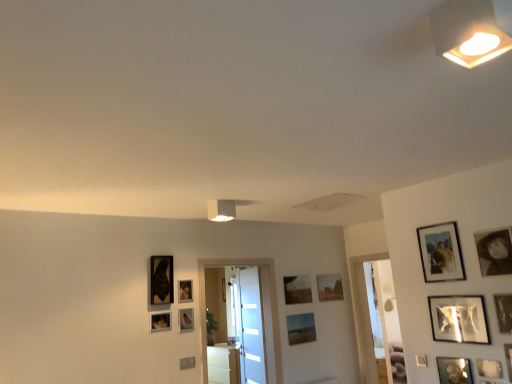
Question: From the image's perspective, does matte wooden picture frame at center, marked as the 10th picture frame in a right-to-left arrangement, appear higher than matte black picture frame at lower left, positioned as the 2th picture frame in left-to-right order?

Choices:
 (A) yes
 (B) no

Answer: (A)

Question: From the image's perspective, is matte wooden picture frame at center, marked as the fifth picture frame in a left-to-right arrangement, beneath matte black picture frame at lower left, marked as the 8th picture frame in a front-to-back arrangement?

Choices:
 (A) no
 (B) yes

Answer: (A)

Question: From a real-world perspective, is matte wooden picture frame at center, which is the 2th picture frame in back-to-front order, under matte black picture frame at lower left, positioned as the thirteenth picture frame in right-to-left order?

Choices:
 (A) yes
 (B) no

Answer: (B)

Question: Does matte wooden picture frame at center, which is the 2th picture frame in back-to-front order, have a lesser height compared to matte black picture frame at lower left, marked as the 8th picture frame in a front-to-back arrangement?

Choices:
 (A) yes
 (B) no

Answer: (B)

Question: Does matte wooden picture frame at center, which is the 2th picture frame in back-to-front order, have a lesser width compared to matte black picture frame at lower left, marked as the 8th picture frame in a front-to-back arrangement?

Choices:
 (A) yes
 (B) no

Answer: (B)

Question: Is matte wooden picture frame at center, marked as the fifth picture frame in a left-to-right arrangement, outside of matte black picture frame at lower left, positioned as the 2th picture frame in left-to-right order?

Choices:
 (A) yes
 (B) no

Answer: (A)

Question: Is matte black picture frame at center, the 4th picture frame when ordered from left to right, far away from matte black picture frame at upper right, which is the eleventh picture frame from left to right?

Choices:
 (A) no
 (B) yes

Answer: (B)

Question: Is matte black picture frame at center, the 11th picture frame when ordered from right to left, to the left of matte black picture frame at upper right, the fourth picture frame viewed from the front, from the viewer's perspective?

Choices:
 (A) yes
 (B) no

Answer: (A)

Question: Is matte black picture frame at center, the 4th picture frame when ordered from left to right, bigger than matte black picture frame at upper right, which is the eleventh picture frame from left to right?

Choices:
 (A) yes
 (B) no

Answer: (A)

Question: From the image's perspective, is matte black picture frame at center, which is the fifth picture frame in back-to-front order, located beneath matte black picture frame at upper right, the fourth picture frame viewed from the front?

Choices:
 (A) no
 (B) yes

Answer: (B)

Question: Can you confirm if matte black picture frame at center, which is the fifth picture frame in back-to-front order, is thinner than matte black picture frame at upper right, which is the eleventh picture frame from left to right?

Choices:
 (A) no
 (B) yes

Answer: (A)

Question: Is matte black picture frame at center, the 4th picture frame when ordered from left to right, at the right side of matte black picture frame at upper right, which is the eleventh picture frame from left to right?

Choices:
 (A) yes
 (B) no

Answer: (B)

Question: Is there a large distance between matte glass picture frame at center, which is counted as the 12th picture frame, starting from the front, and matte black picture frame at left, marked as the 9th picture frame in a front-to-back arrangement?

Choices:
 (A) yes
 (B) no

Answer: (A)